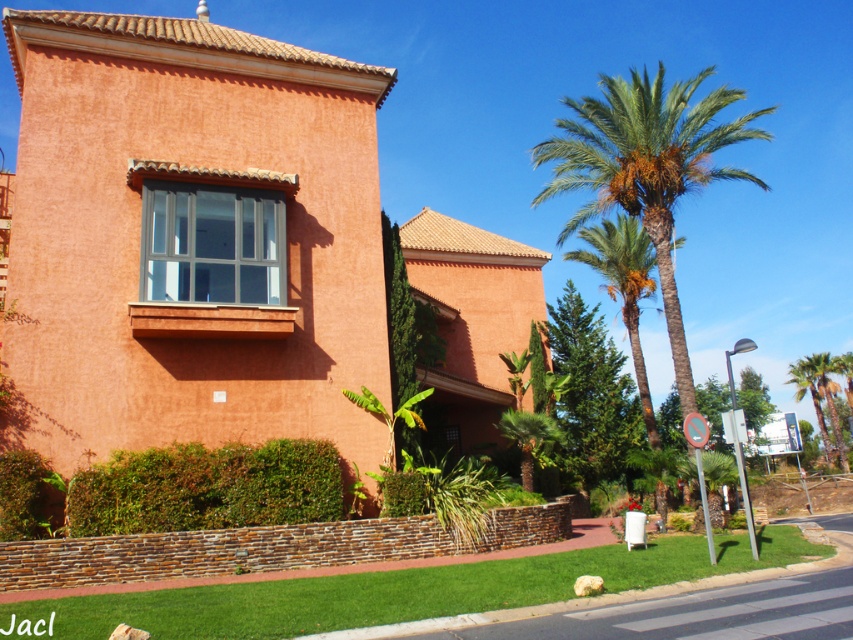
In the scene shown: You are standing in the garden area and want to walk towards the green leafy palm at right and the brown stone curb at lower center. Which object will you encounter first?

The green leafy palm at right will be encountered first because it is closer to the viewer than the brown stone curb at lower center, as per the spatial arrangement described.

You are standing in the garden area of the building and need to walk from the brown stone curb at lower center to the green leafy palm tree at right. Which direction should you move to reach the palm tree?

Since the brown stone curb at lower center is located above the green leafy palm tree at right, you should move downward to reach the palm tree.